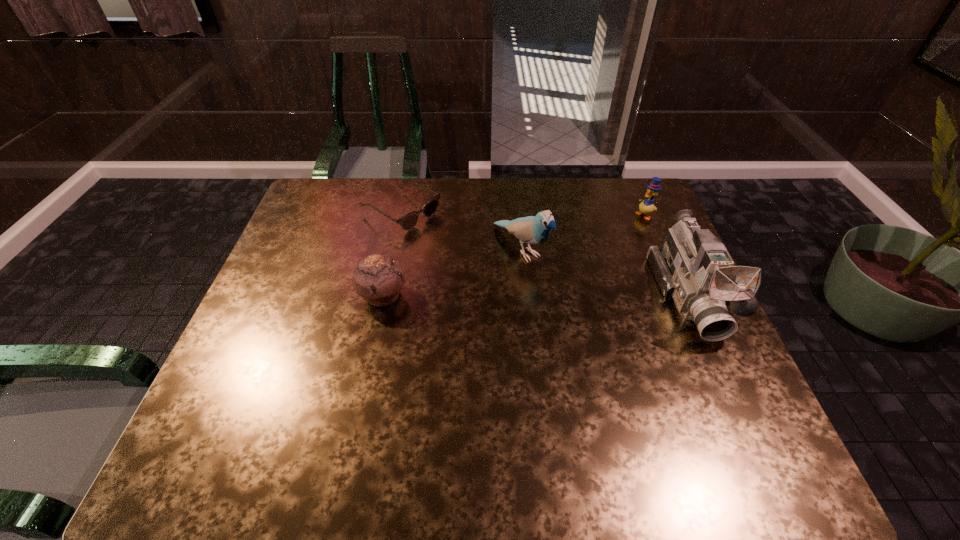
This screenshot has width=960, height=540. Identify the location of vacant area between the bird and the muffin. (452, 272).

Locate an element on the screen. The image size is (960, 540). free space between the duckling and the muffin is located at coordinates (514, 255).

Where is `empty space between the sunglasses and the bird`? This screenshot has height=540, width=960. empty space between the sunglasses and the bird is located at coordinates (461, 230).

Where is `blank region between the duckling and the muffin`? The width and height of the screenshot is (960, 540). blank region between the duckling and the muffin is located at coordinates (514, 255).

You are a GUI agent. You are given a task and a screenshot of the screen. Output one action in this format:
    pyautogui.click(x=<x>, y=<y>)
    Task: Click on the vacant area that lies between the duckling and the bird
    
    Given the screenshot: What is the action you would take?
    pyautogui.click(x=583, y=232)

The width and height of the screenshot is (960, 540). Find the location of `object identified as the fourth closest to the sunglasses`. object identified as the fourth closest to the sunglasses is located at coordinates (646, 206).

Identify the location of object that is the fourth closest to the shortest object. pyautogui.click(x=646, y=206).

Identify the location of vacant point that satisfies the following two spatial constraints: 1. on the front side of the sunglasses; 2. on the right side of the duckling. Image resolution: width=960 pixels, height=540 pixels. (400, 215).